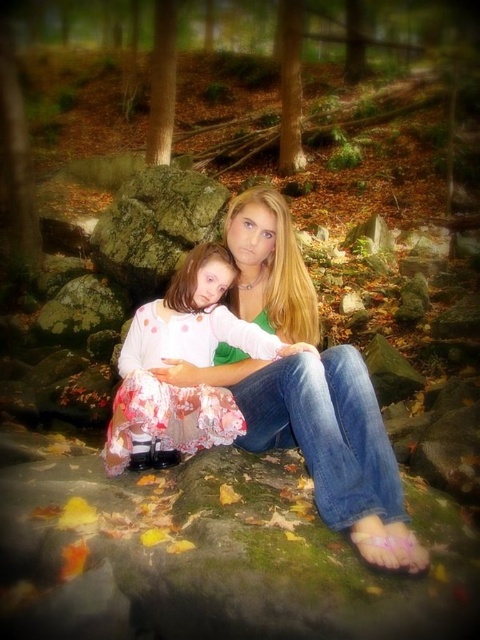
Question: Which object appears closest to the camera in this image?

Choices:
 (A) green mossy rock at left
 (B) matte green blouse at center

Answer: (B)

Question: Which point is closer to the camera?

Choices:
 (A) click(155, 349)
 (B) click(130, 262)
 (C) click(335, 410)
 (D) click(73, 333)

Answer: (C)

Question: Is matte green blouse at center positioned in front of green mossy rock at left?

Choices:
 (A) yes
 (B) no

Answer: (A)

Question: Does matte green blouse at center appear on the left side of green mossy rock at center?

Choices:
 (A) no
 (B) yes

Answer: (A)

Question: Is matte green blouse at center closer to camera compared to white polka dot dress at center?

Choices:
 (A) yes
 (B) no

Answer: (A)

Question: Which of these objects is positioned closest to the white polka dot dress at center?

Choices:
 (A) matte green blouse at center
 (B) green mossy rock at center
 (C) green mossy rock at left

Answer: (A)